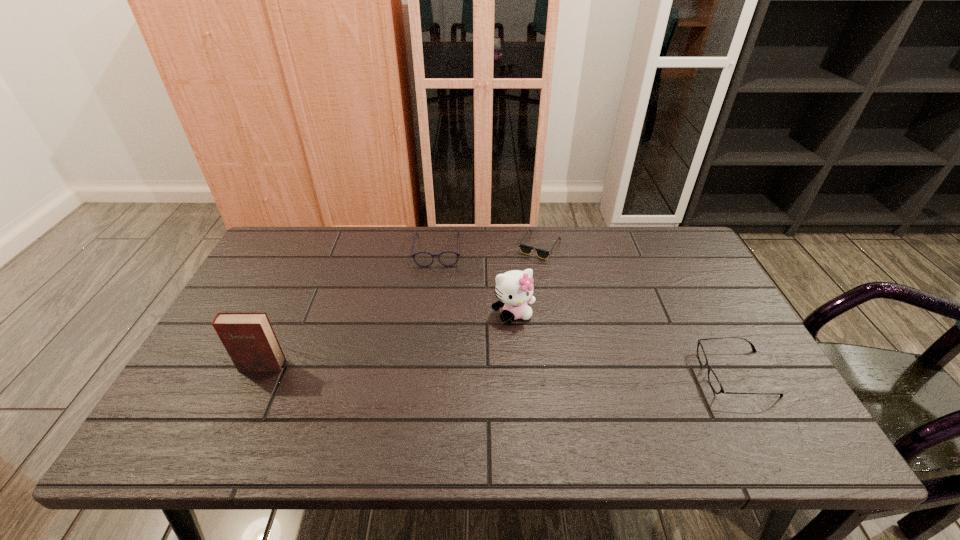
The height and width of the screenshot is (540, 960). In order to click on vacant space on the desktop that is between the diary and the nearer spectacles and is positioned on the front-facing side of the third shortest object in this screenshot , I will do `click(431, 368)`.

Where is `free space on the desktop that is between the leftmost object and the right spectacles and is positioned on the front-facing side of the third farthest object`? This screenshot has height=540, width=960. free space on the desktop that is between the leftmost object and the right spectacles and is positioned on the front-facing side of the third farthest object is located at coordinates (540, 370).

Image resolution: width=960 pixels, height=540 pixels. I want to click on free spot on the desktop that is between the diary and the right spectacles and is positioned on the lenses of the shortest object, so click(x=566, y=370).